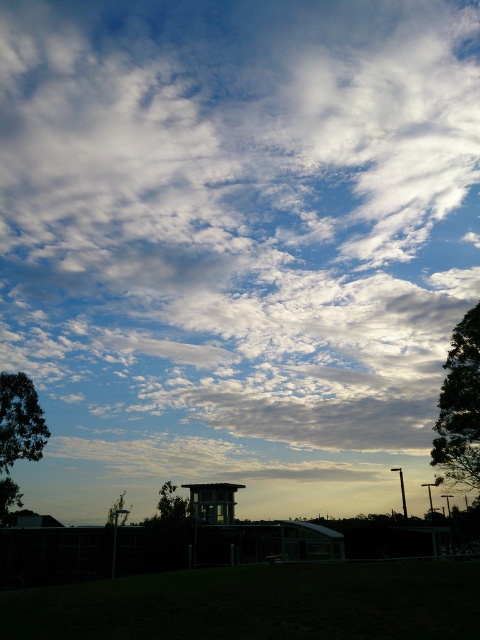
Based on the photo, is green leafy tree at right taller than green leafy tree at lower left?

Incorrect, green leafy tree at right's height is not larger of green leafy tree at lower left's.

Who is more forward, (x=475, y=308) or (x=113, y=520)?

Point (x=475, y=308) is in front.

The width and height of the screenshot is (480, 640). Identify the location of green leafy tree at right. (459, 406).

Can you confirm if green leafy tree at left is positioned below green leafy tree at lower center?

No, green leafy tree at left is not below green leafy tree at lower center.

Between point (21, 412) and point (155, 515), which one is positioned in front?

Point (21, 412) is more forward.

Between point (12, 422) and point (184, 516), which one is positioned in front?

Point (184, 516)

What are the coordinates of `green leafy tree at left` in the screenshot? It's located at (20, 420).

Can you confirm if green leafy tree at left is positioned below green leafy tree at lower left?

Actually, green leafy tree at left is above green leafy tree at lower left.

Which is more to the left, green leafy tree at left or green leafy tree at lower left?

From the viewer's perspective, green leafy tree at lower left appears more on the left side.

Identify the location of green leafy tree at left. (20, 420).